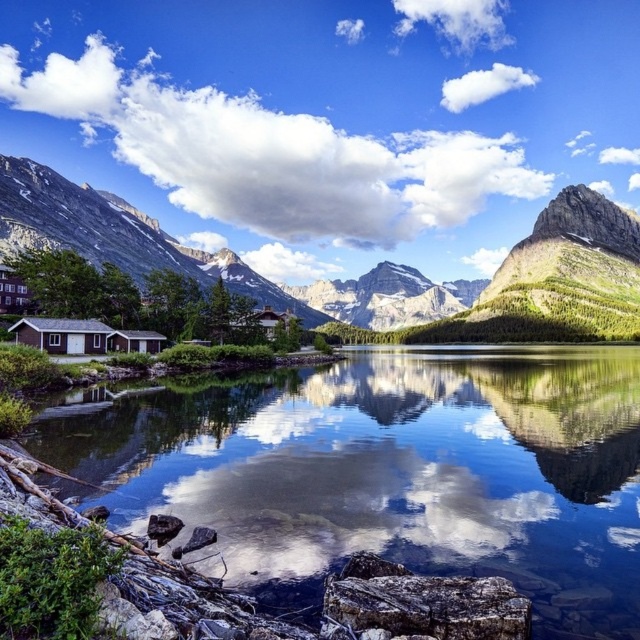
You are a hiker standing at the edge of the lake and want to take a photo of the clear glass water at center and the green grassy mountain at center. Which object should you focus on first if you want both to be in sharp focus?

You should focus on the green grassy mountain at center first because it is farther away from the clear glass water at center, ensuring both will be in focus when using depth of field.

You are standing at the edge of the lake and want to take a photo of both the clear glass water at center and the green grassy mountain at center. Since you have a wide angle lens, will you be able to capture both in the same frame?

The clear glass water at center is in front of the green grassy mountain at center, so yes, you can capture both in the same frame as they are aligned along the same line of sight.